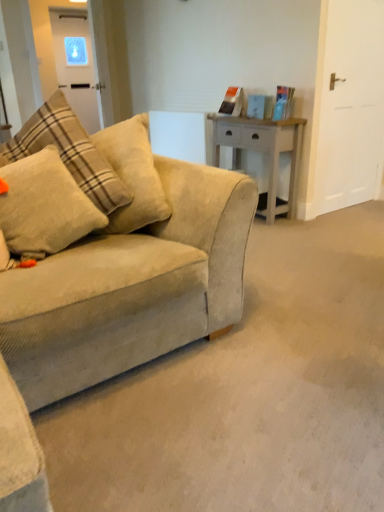
Question: From a real-world perspective, is white matte door at right, marked as the second glass door in a back-to-front arrangement, over fluffy beige pillow at left?

Choices:
 (A) yes
 (B) no

Answer: (A)

Question: Does white matte door at right, marked as the second glass door in a back-to-front arrangement, have a lesser height compared to fluffy beige pillow at left?

Choices:
 (A) no
 (B) yes

Answer: (A)

Question: From the image's perspective, does white matte door at right, which is the 1th glass door from right to left, appear lower than fluffy beige pillow at left?

Choices:
 (A) no
 (B) yes

Answer: (A)

Question: Is white matte door at right, which ranks as the second glass door in left-to-right order, oriented towards fluffy beige pillow at left?

Choices:
 (A) no
 (B) yes

Answer: (A)

Question: Would you consider white matte door at right, which ranks as the second glass door in left-to-right order, to be distant from fluffy beige pillow at left?

Choices:
 (A) yes
 (B) no

Answer: (A)

Question: Could fluffy beige pillow at left be considered to be inside white matte door at right, which is the 1th glass door in front-to-back order?

Choices:
 (A) no
 (B) yes

Answer: (A)

Question: From the image's perspective, is white matte door at right, which ranks as the second glass door in left-to-right order, located beneath white wood side table at center?

Choices:
 (A) no
 (B) yes

Answer: (A)

Question: From a real-world perspective, is white matte door at right, which is the 1th glass door in front-to-back order, beneath white wood side table at center?

Choices:
 (A) yes
 (B) no

Answer: (B)

Question: Is white matte door at right, which ranks as the second glass door in left-to-right order, far away from white wood side table at center?

Choices:
 (A) yes
 (B) no

Answer: (B)

Question: Could you tell me if white matte door at right, marked as the second glass door in a back-to-front arrangement, is turned towards white wood side table at center?

Choices:
 (A) no
 (B) yes

Answer: (A)

Question: Can you confirm if white matte door at right, which is the 1th glass door from right to left, is thinner than white wood side table at center?

Choices:
 (A) no
 (B) yes

Answer: (B)

Question: Is white wood side table at center completely or partially inside white matte door at right, which ranks as the second glass door in left-to-right order?

Choices:
 (A) yes
 (B) no

Answer: (B)

Question: Does white matte door at right, which is the 1th glass door from right to left, have a lesser width compared to transparent glass door at upper left, which appears as the second glass door when viewed from the front?

Choices:
 (A) yes
 (B) no

Answer: (A)